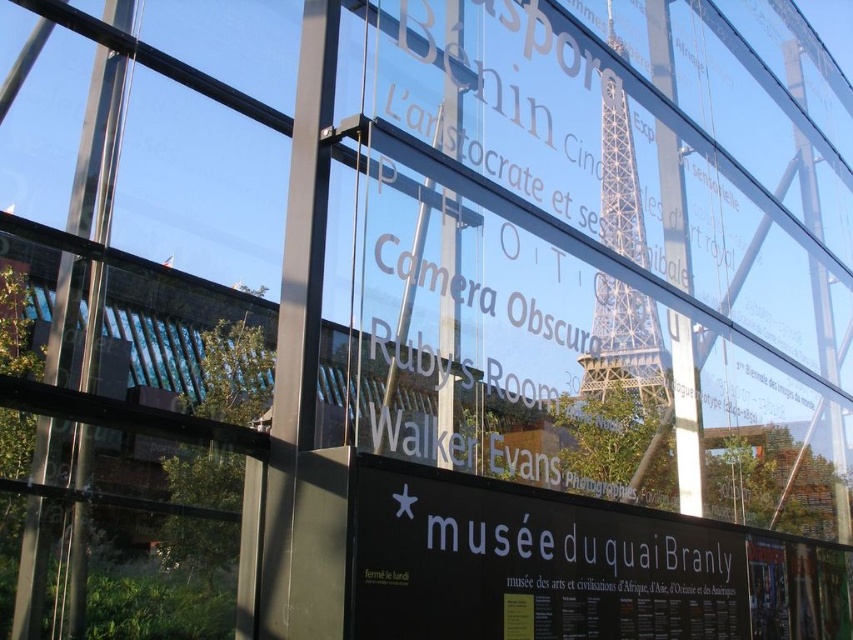
Question: Is black matte sign at center wider than metallic silver eiffel tower at center?

Choices:
 (A) yes
 (B) no

Answer: (B)

Question: Can you confirm if black matte sign at center is positioned below metallic silver eiffel tower at center?

Choices:
 (A) yes
 (B) no

Answer: (A)

Question: Among these objects, which one is nearest to the camera?

Choices:
 (A) black matte sign at center
 (B) metallic silver eiffel tower at center

Answer: (A)

Question: Which of the following is the farthest from the observer?

Choices:
 (A) (422, 595)
 (B) (606, 316)

Answer: (B)

Question: Which point is farther to the camera?

Choices:
 (A) metallic silver eiffel tower at center
 (B) black matte sign at center

Answer: (A)

Question: Can you confirm if black matte sign at center is positioned above metallic silver eiffel tower at center?

Choices:
 (A) no
 (B) yes

Answer: (A)